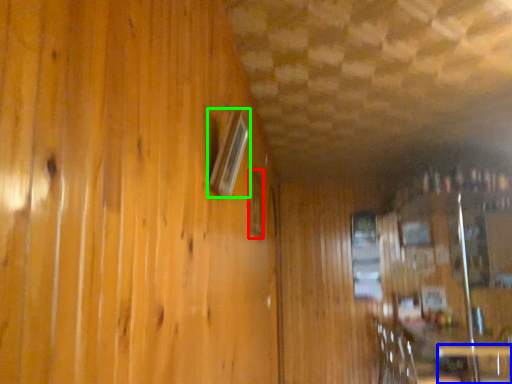
Question: Considering the real-world distances, which object is farthest from window (highlighted by a red box)? table (highlighted by a blue box) or window (highlighted by a green box)?

Choices:
 (A) table
 (B) window

Answer: (A)